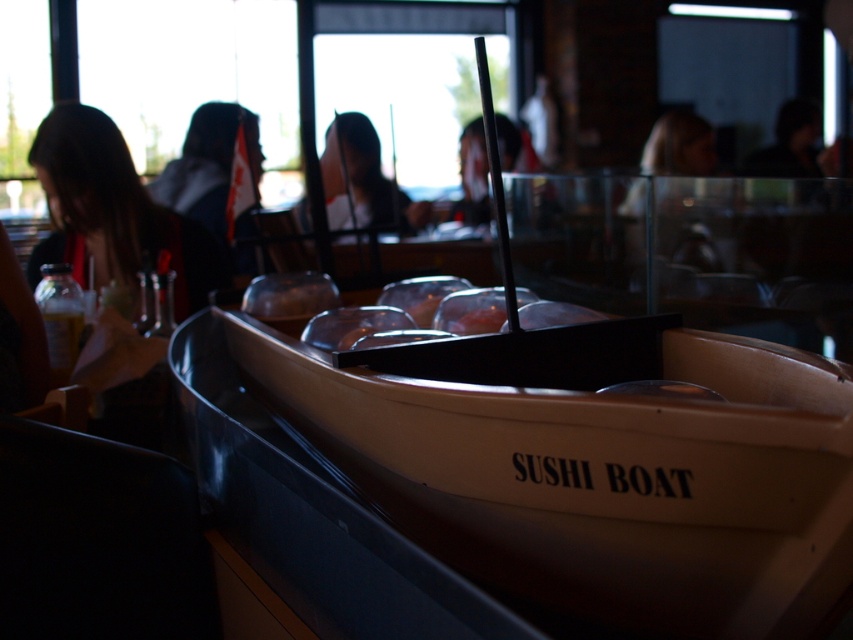
Is dark brown hair at left thinner than smooth black hair at center?

Incorrect, dark brown hair at left's width is not less than smooth black hair at center's.

The image size is (853, 640). I want to click on dark brown hair at left, so click(x=114, y=214).

Which is in front, point (215, 280) or point (468, 154)?

Point (215, 280) is more forward.

The width and height of the screenshot is (853, 640). Find the location of `dark brown hair at left`. dark brown hair at left is located at coordinates (114, 214).

Can you confirm if wooden sushi boat at center is shorter than smooth black hair at center?

Correct, wooden sushi boat at center is not as tall as smooth black hair at center.

Can you confirm if wooden sushi boat at center is thinner than smooth black hair at center?

No.

Between point (723, 532) and point (479, 182), which one is positioned in front?

Point (723, 532) is in front.

The height and width of the screenshot is (640, 853). What are the coordinates of `wooden sushi boat at center` in the screenshot? It's located at (601, 481).

Between wooden sushi boat at center and dark brown hair at left, which one has less height?

Standing shorter between the two is wooden sushi boat at center.

Locate an element on the screen. The width and height of the screenshot is (853, 640). wooden sushi boat at center is located at coordinates (601, 481).